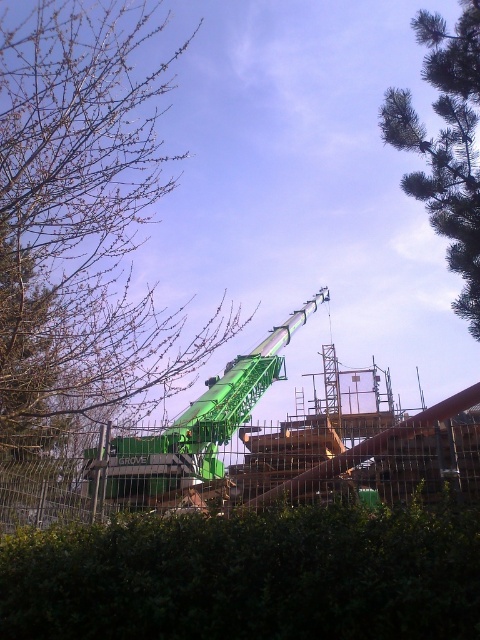
Is bare branches at upper left bigger than green pine tree at upper right?

Indeed, bare branches at upper left has a larger size compared to green pine tree at upper right.

What do you see at coordinates (82, 218) in the screenshot? I see `bare branches at upper left` at bounding box center [82, 218].

Is point (40, 116) closer to camera compared to point (415, 140)?

Yes, point (40, 116) is in front of point (415, 140).

This screenshot has width=480, height=640. I want to click on bare branches at upper left, so click(x=82, y=218).

Which is in front, point (79, 131) or point (109, 548)?

Point (109, 548) is more forward.

Which is more to the right, bare branches at upper left or green leafy hedge at lower center?

green leafy hedge at lower center is more to the right.

The height and width of the screenshot is (640, 480). In order to click on bare branches at upper left in this screenshot , I will do `click(82, 218)`.

Does bare branches at upper left have a greater height compared to green matte crane at center?

Yes.

Between bare branches at upper left and green matte crane at center, which one is positioned lower?

Positioned lower is green matte crane at center.

Describe the element at coordinates (82, 218) in the screenshot. The image size is (480, 640). I see `bare branches at upper left` at that location.

Locate an element on the screen. bare branches at upper left is located at coordinates (82, 218).